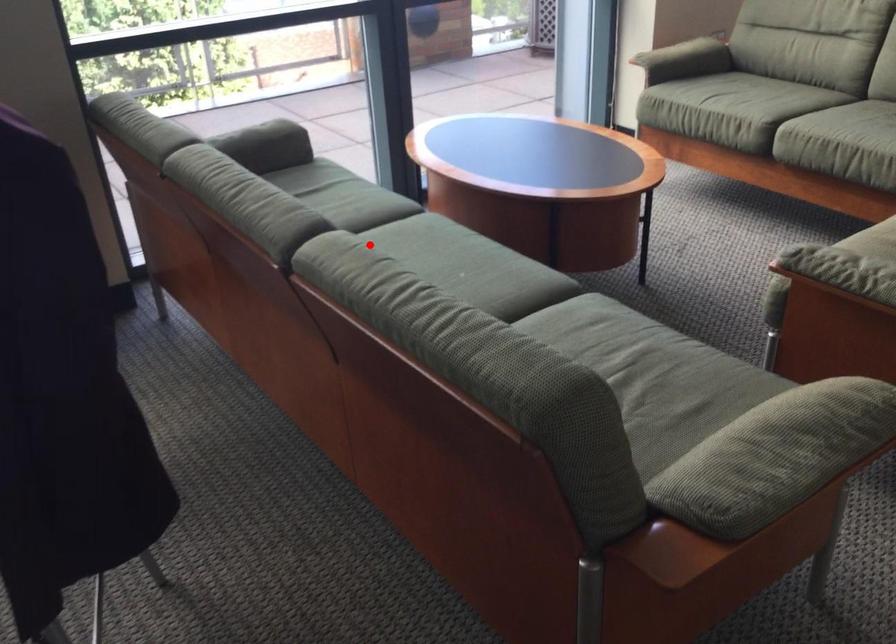
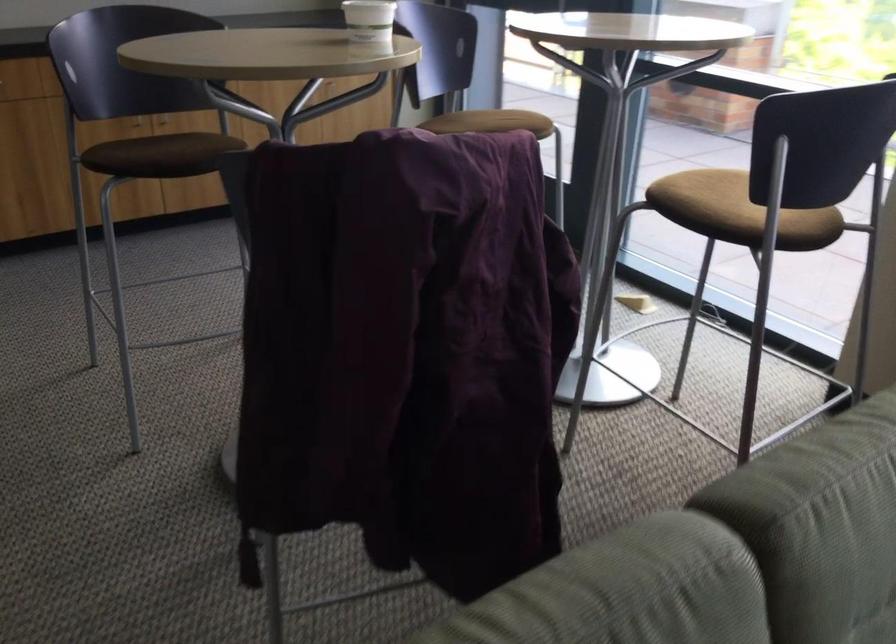
Where in the second image is the point corresponding to the highlighted location from the first image?

(668, 585)